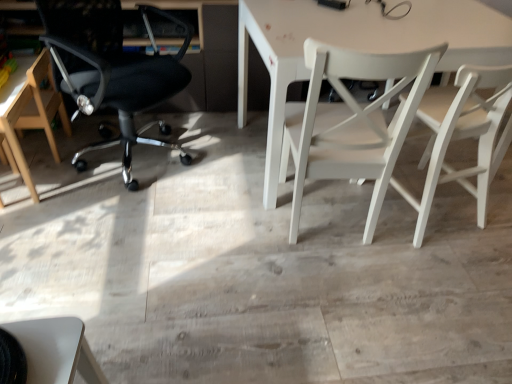
Where is `vacant region to the left of white matte chair at center, the 2th chair from the right`? Image resolution: width=512 pixels, height=384 pixels. vacant region to the left of white matte chair at center, the 2th chair from the right is located at coordinates click(x=225, y=212).